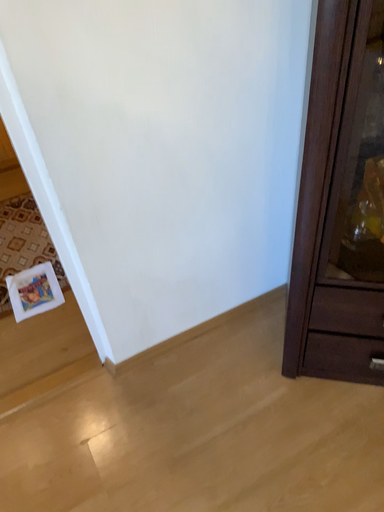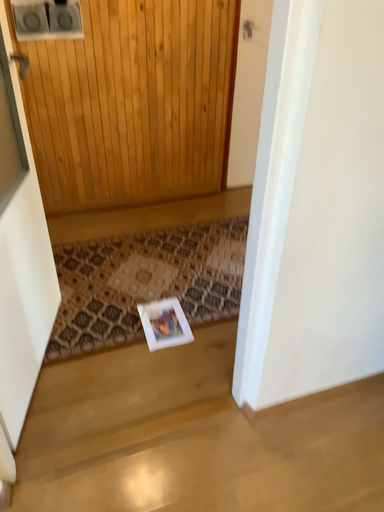
Question: How did the camera likely rotate when shooting the video?

Choices:
 (A) rotated downward
 (B) rotated upward

Answer: (B)